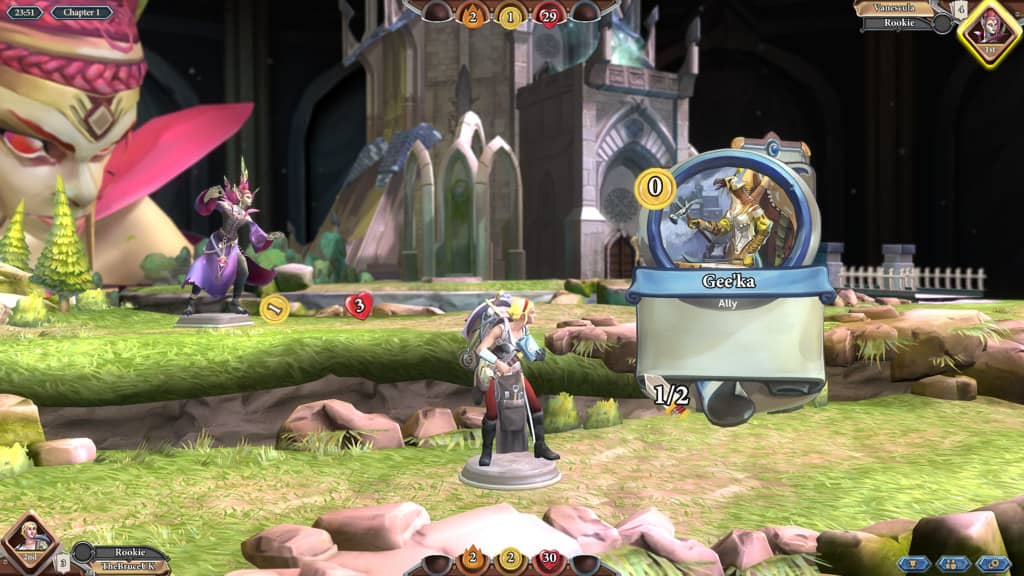
Find the location of a particular element. This screenshot has height=576, width=1024. figurine is located at coordinates (511, 360).